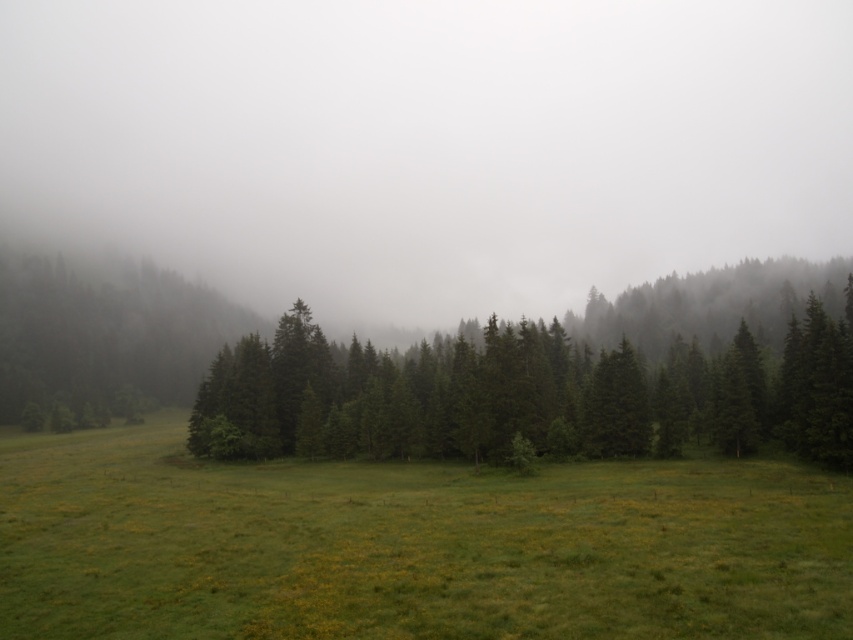
Looking at this image, between green grass at center and green matte tree at center, which one appears on the right side from the viewer's perspective?

Positioned to the right is green matte tree at center.

Between point (811, 502) and point (527, 330), which one is positioned behind?

Positioned behind is point (527, 330).

This screenshot has width=853, height=640. I want to click on green grass at center, so click(x=410, y=545).